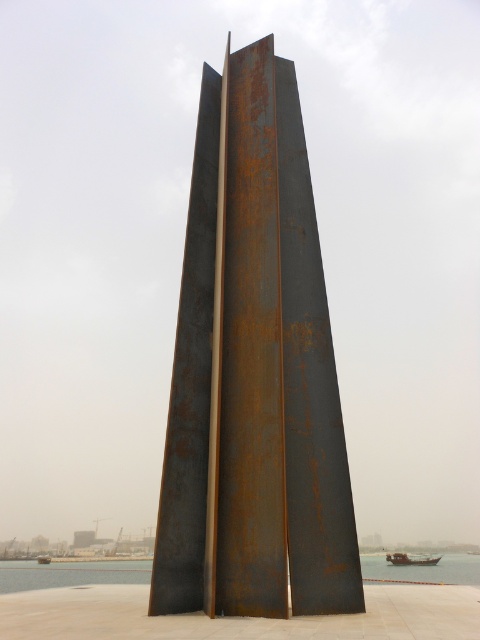
You are an art student analyzing the sculpture and boat in the image. Which object, the rusty metal sculpture at center or the rusty metal boat at lower left, would cast a longer shadow during midday when the sun is directly overhead?

The rusty metal sculpture at center has a greater height compared to the rusty metal boat at lower left. Since taller objects cast longer shadows, the rusty metal sculpture at center would cast a longer shadow during midday when the sun is directly overhead.

You are an artist planning to photograph the rusty metal sculpture at center and the clear water at center. You want to ensure both elements are visible in the frame. Based on their sizes, which object should you focus on to include both in the composition?

The rusty metal sculpture at center has a lesser width compared to clear water at center, so focusing on the larger clear water at center would allow both elements to fit within the frame while maintaining balance.